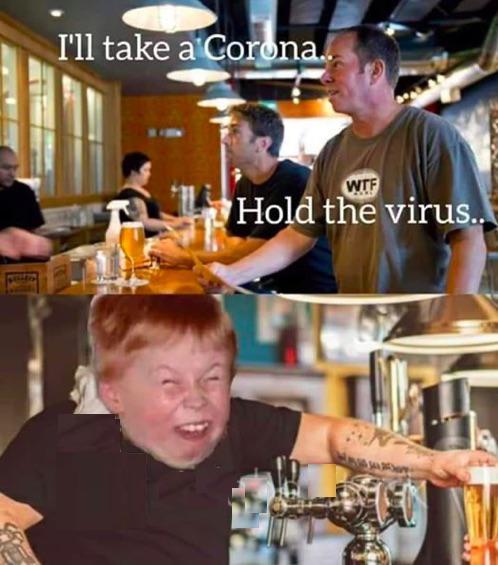
Find the location of `spray bottle`. spray bottle is located at coordinates (112, 224).